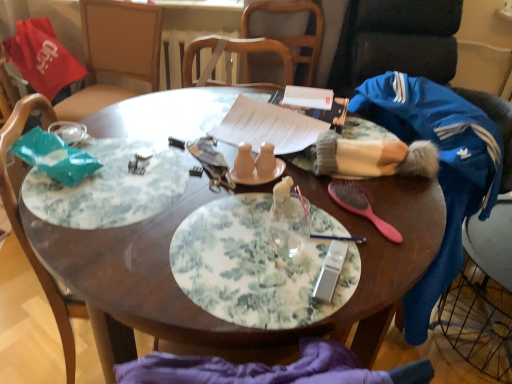
Image resolution: width=512 pixels, height=384 pixels. In order to click on empty space that is ontop of green floral placemat at left (from a real-world perspective) in this screenshot , I will do `click(124, 174)`.